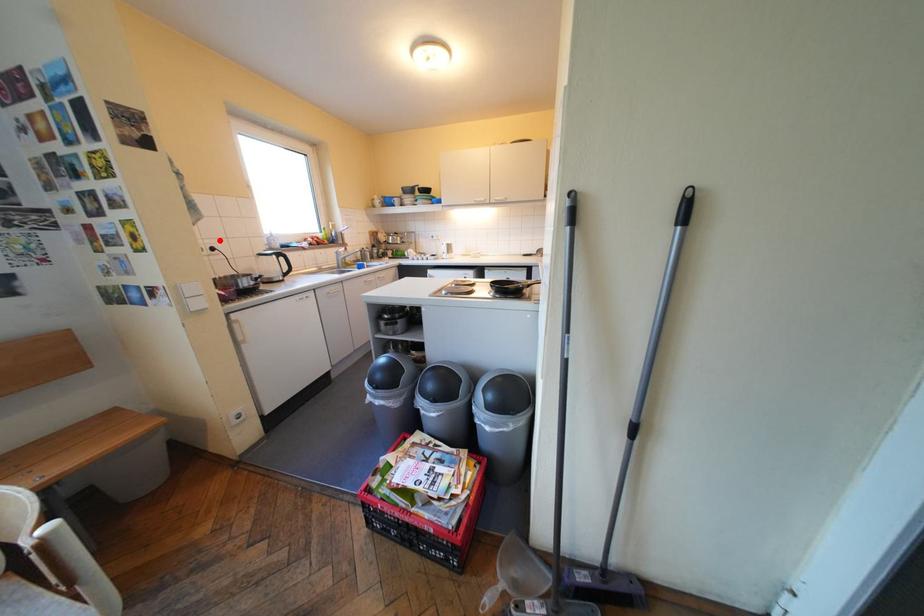
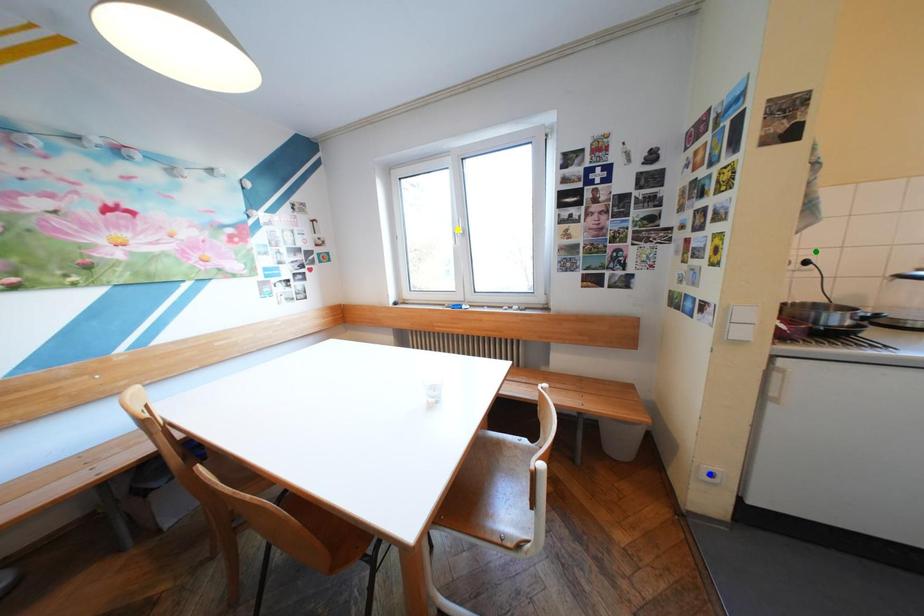
Question: I am providing you with two images of the same scene from different viewpoints. A red point is marked on the first image. You are given multiple points on the second image. Which spot in image 2 lines up with the point in image 1?

Choices:
 (A) green point
 (B) yellow point
 (C) blue point

Answer: (A)